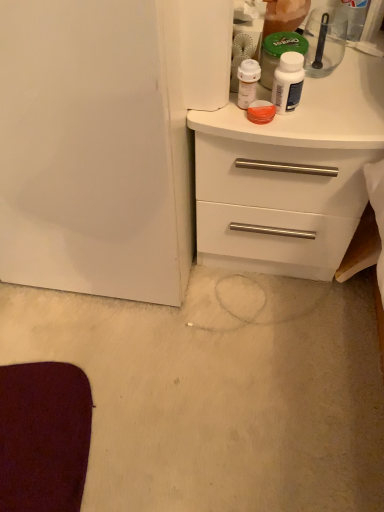
Question: Are white matte chest of drawers at upper right and transparent plastic spoon at upper right beside each other?

Choices:
 (A) no
 (B) yes

Answer: (A)

Question: From a real-world perspective, is white matte chest of drawers at upper right below transparent plastic spoon at upper right?

Choices:
 (A) no
 (B) yes

Answer: (B)

Question: From a real-world perspective, is white matte chest of drawers at upper right over transparent plastic spoon at upper right?

Choices:
 (A) yes
 (B) no

Answer: (B)

Question: Can you confirm if white matte chest of drawers at upper right is thinner than transparent plastic spoon at upper right?

Choices:
 (A) yes
 (B) no

Answer: (B)

Question: Can you confirm if white matte chest of drawers at upper right is shorter than transparent plastic spoon at upper right?

Choices:
 (A) yes
 (B) no

Answer: (B)

Question: Is white matte chest of drawers at upper right at the right side of transparent plastic spoon at upper right?

Choices:
 (A) yes
 (B) no

Answer: (B)

Question: Can you confirm if white glossy bottle at upper right is bigger than white matte chest of drawers at upper right?

Choices:
 (A) no
 (B) yes

Answer: (A)

Question: From the image's perspective, is white glossy bottle at upper right over white matte chest of drawers at upper right?

Choices:
 (A) yes
 (B) no

Answer: (A)

Question: Does white glossy bottle at upper right contain white matte chest of drawers at upper right?

Choices:
 (A) yes
 (B) no

Answer: (B)

Question: Is white glossy bottle at upper right outside white matte chest of drawers at upper right?

Choices:
 (A) yes
 (B) no

Answer: (A)

Question: Is white glossy bottle at upper right facing away from white matte chest of drawers at upper right?

Choices:
 (A) yes
 (B) no

Answer: (B)

Question: Can you confirm if white glossy bottle at upper right is positioned to the right of white matte chest of drawers at upper right?

Choices:
 (A) no
 (B) yes

Answer: (A)

Question: From a real-world perspective, is transparent plastic spoon at upper right under white glossy bottle at upper right?

Choices:
 (A) yes
 (B) no

Answer: (B)